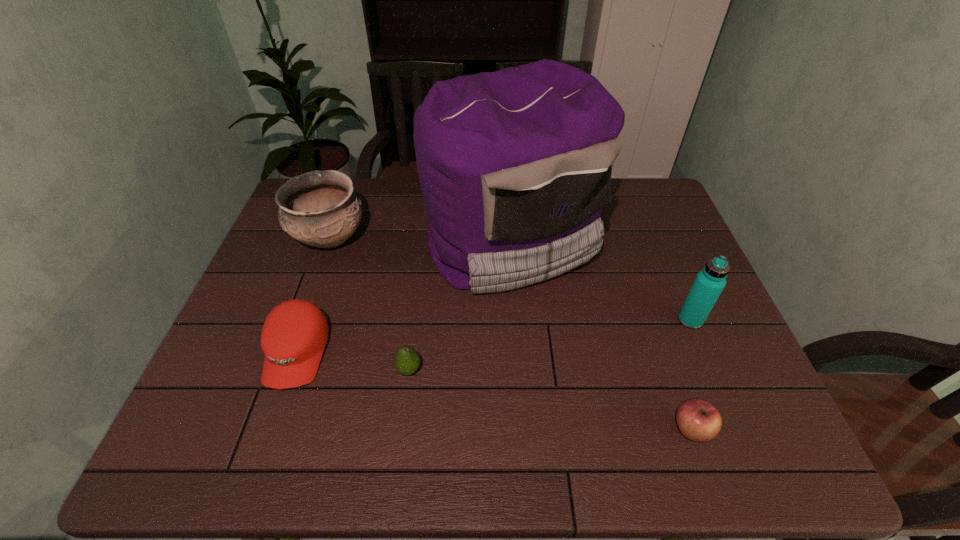
Find the location of a particular element. This screenshot has height=540, width=960. apple that is positioned at the right edge is located at coordinates (698, 420).

Identify the location of object situated at the far left corner. Image resolution: width=960 pixels, height=540 pixels. (319, 208).

Where is `object at the near right corner`? This screenshot has width=960, height=540. object at the near right corner is located at coordinates (698, 420).

Where is `vacant area at the far edge of the desktop`? vacant area at the far edge of the desktop is located at coordinates (375, 208).

Find the location of `vacant space at the near edge`. vacant space at the near edge is located at coordinates (328, 430).

This screenshot has height=540, width=960. In order to click on vacant point at the left edge in this screenshot , I will do `click(308, 278)`.

Locate an element on the screen. Image resolution: width=960 pixels, height=540 pixels. vacant space at the right edge is located at coordinates (678, 272).

The height and width of the screenshot is (540, 960). I want to click on free area in between the rightmost object and the tallest object, so click(x=601, y=281).

The image size is (960, 540). What are the coordinates of `free spot between the cap and the avocado` in the screenshot? It's located at (353, 361).

Find the location of `free space between the cap and the water bottle`. free space between the cap and the water bottle is located at coordinates (493, 336).